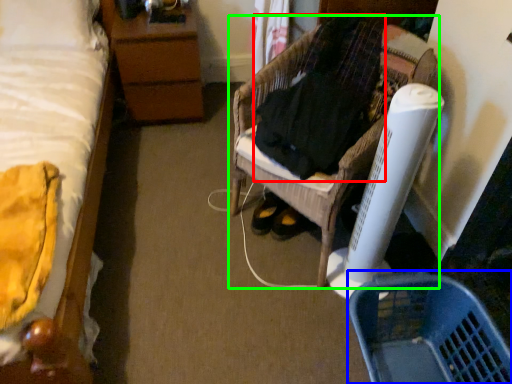
Question: Which object is the closest to the clothing (highlighted by a red box)? Choose among these: basket (highlighted by a blue box) or furniture (highlighted by a green box).

Choices:
 (A) basket
 (B) furniture

Answer: (B)